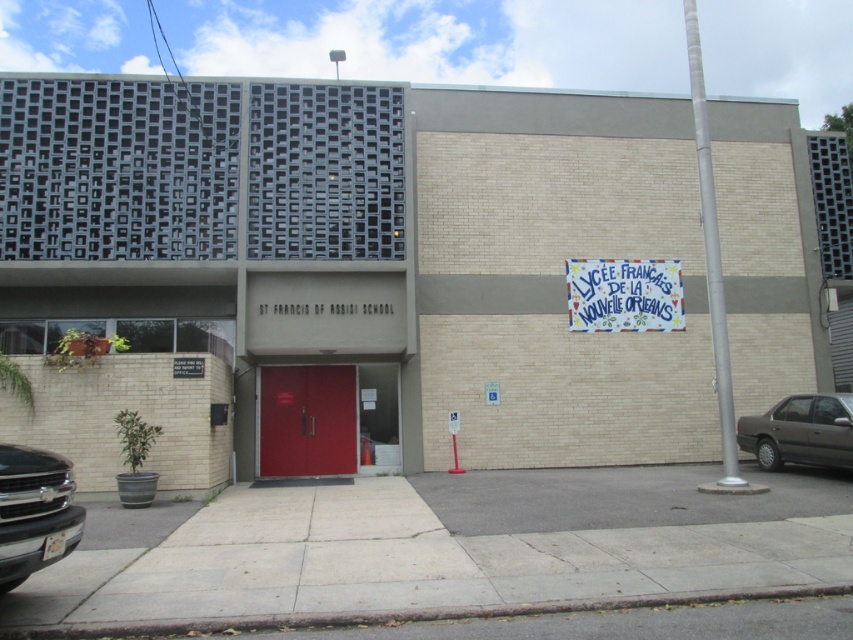
Is point (57, 488) closer to camera compared to point (763, 448)?

Yes, point (57, 488) is closer to viewer.

Is black glossy truck at lower left positioned behind dark gray metallic sedan at lower right?

No, black glossy truck at lower left is in front of dark gray metallic sedan at lower right.

Does point (51, 488) come closer to viewer compared to point (791, 429)?

Yes.

Find the location of `black glossy truck at lower left`. black glossy truck at lower left is located at coordinates (33, 512).

Is matte red door at center smaller than black glossy truck at lower left?

Incorrect, matte red door at center is not smaller in size than black glossy truck at lower left.

Where is `matte red door at center`? This screenshot has width=853, height=640. matte red door at center is located at coordinates (306, 420).

Locate an element on the screen. The width and height of the screenshot is (853, 640). matte red door at center is located at coordinates (306, 420).

Can you confirm if matte red door at center is wider than dark gray metallic sedan at lower right?

Correct, the width of matte red door at center exceeds that of dark gray metallic sedan at lower right.

Who is shorter, matte red door at center or dark gray metallic sedan at lower right?

dark gray metallic sedan at lower right is shorter.

Who is more forward, (300, 417) or (782, 422)?

Point (782, 422) is in front.

This screenshot has width=853, height=640. I want to click on matte red door at center, so [306, 420].